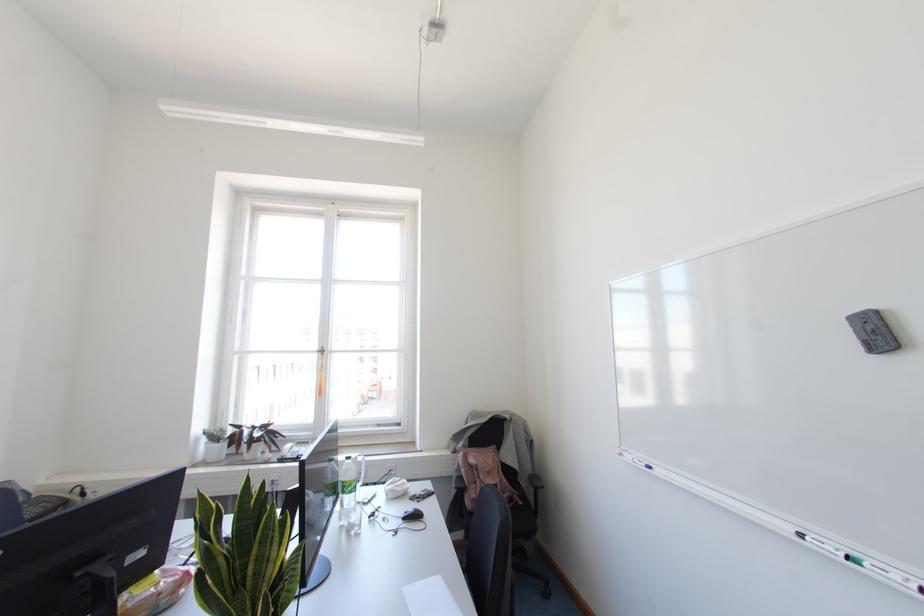
Where is `black computer mouse`? The image size is (924, 616). black computer mouse is located at coordinates (411, 515).